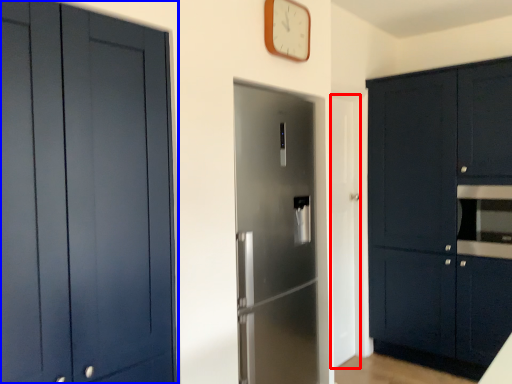
Question: Which object appears closest to the camera in this image, door (highlighted by a red box) or cabinetry (highlighted by a blue box)?

Choices:
 (A) door
 (B) cabinetry

Answer: (B)